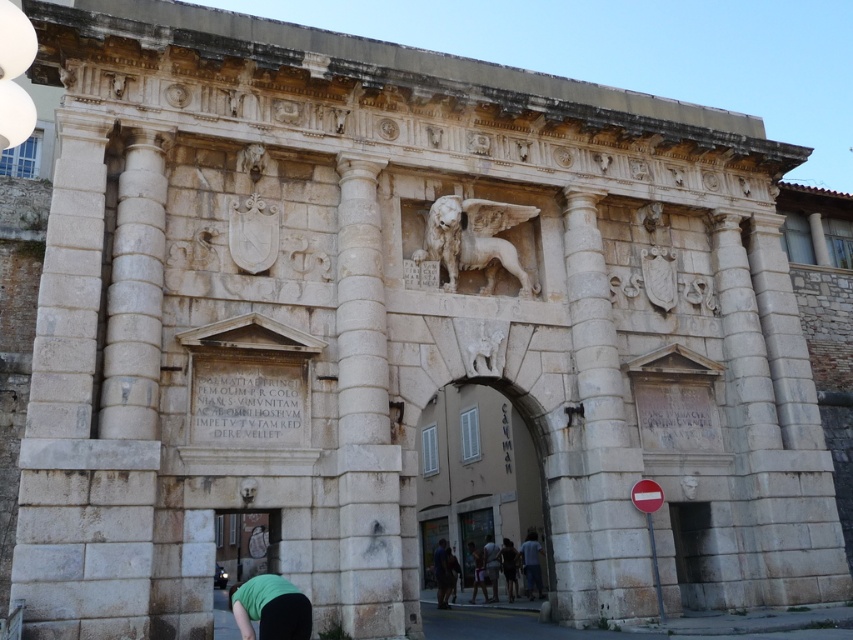
You are standing in front of the historic stone structure and want to touch both the white stone column at right and the stone archway at center. Which one can you reach first without moving your feet?

The white stone column at right is closer to the viewer than the stone archway at center, so you can reach it first without moving your feet.

You are an architect designing a new monument and want to incorporate elements from this archway. You have two white stone sculptures to place symmetrically on either side of the entrance. The first is the white stone winged lion at center from the archway, and the second is the white stone statue at lower center. Which sculpture should be placed closer to the entrance to maintain symmetry and balance?

The white stone winged lion at center is thinner than the white stone statue at lower center. To maintain symmetry and balance, the thinner winged lion should be placed closer to the entrance so that its smaller size is visually balanced against the larger statue positioned farther back.

Consider the image. You are standing in front of the historic stone archway and want to touch both the white stone winged lion at center and the white stone statue at lower center. Which one can you reach without moving your position?

The white stone winged lion at center is further to the viewer than the white stone statue at lower center, so you can reach the white stone winged lion at center without moving your position, but the white stone statue at lower center is behind it and might be out of reach.